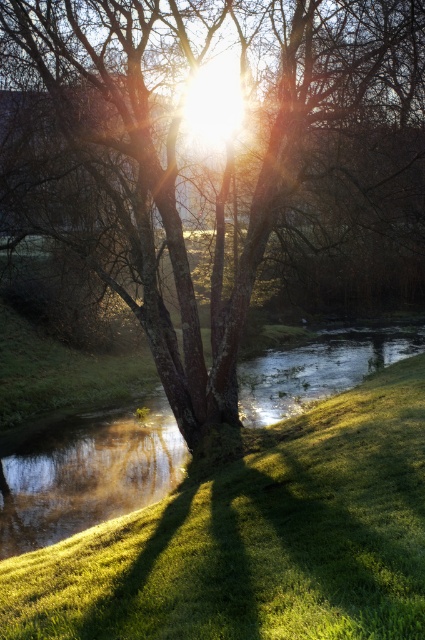
You are standing on the grassy slope and want to walk towards the smooth bark tree at center and the green grassy at center. Which one will you reach first?

You will reach the smooth bark tree at center first because it is closer to you than the green grassy at center, which is further away.

You are standing on the green grassy at center and want to reach the smooth bark tree at center. Which direction should you walk to get closer to the tree?

Since the smooth bark tree at center has a larger size compared to green grassy at center, you should walk towards the direction of the tree to get closer.